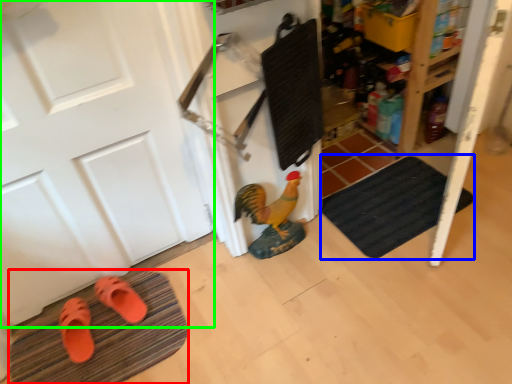
Question: Which object is positioned closest to bath mat (highlighted by a red box)? Select from bath mat (highlighted by a blue box) and door (highlighted by a green box).

Choices:
 (A) bath mat
 (B) door

Answer: (B)